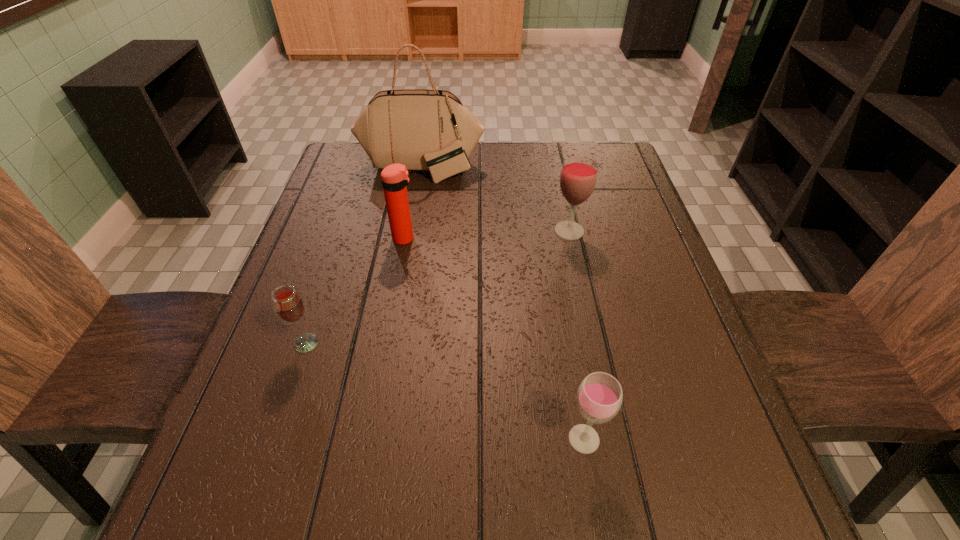
What are the coordinates of `free space at the near right corner of the desktop` in the screenshot? It's located at (721, 517).

I want to click on empty space between the second farthest wineglass and the handbag, so click(x=364, y=256).

What are the coordinates of `free spot between the farthest object and the thermos bottle` in the screenshot? It's located at (413, 204).

Identify the location of free spot between the farthest object and the fourth farthest object. The height and width of the screenshot is (540, 960). (364, 256).

Where is `vacant space in between the nearest object and the thermos bottle`? Image resolution: width=960 pixels, height=540 pixels. vacant space in between the nearest object and the thermos bottle is located at coordinates (494, 339).

This screenshot has height=540, width=960. I want to click on vacant space that's between the leftmost wineglass and the handbag, so click(x=364, y=256).

You are a GUI agent. You are given a task and a screenshot of the screen. Output one action in this format:
    pyautogui.click(x=<x>, y=<y>)
    Task: Click on the vacant point located between the farthest wineglass and the thermos bottle
    The height and width of the screenshot is (540, 960).
    Given the screenshot: What is the action you would take?
    pyautogui.click(x=487, y=235)

The image size is (960, 540). In order to click on free space between the nearest object and the fourth farthest object in this screenshot , I will do `click(445, 391)`.

I want to click on free area in between the farthest object and the second nearest object, so click(x=364, y=256).

Image resolution: width=960 pixels, height=540 pixels. Identify the location of blank region between the thermos bottle and the nearest wineglass. (494, 339).